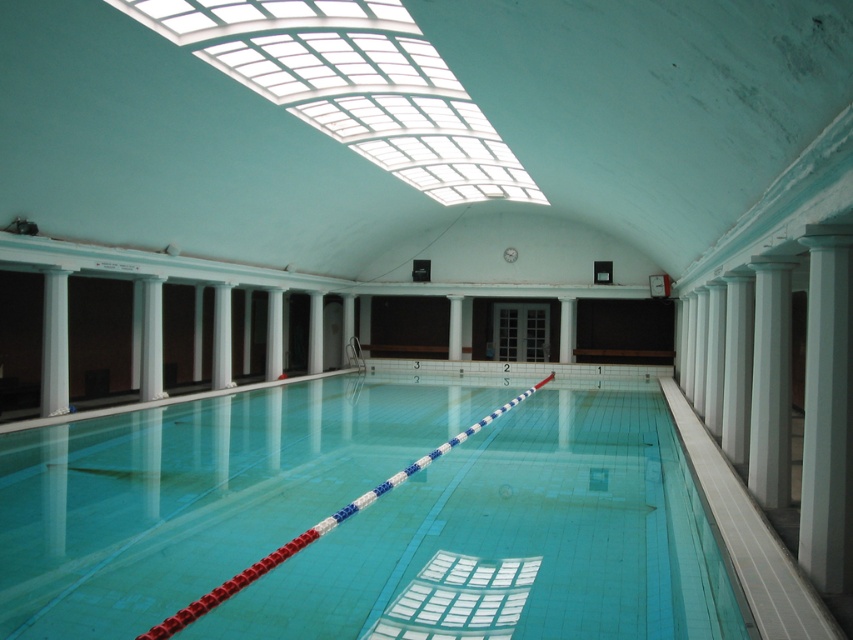
Consider the image. Is blue glossy pool at center positioned in front of white smooth column at right?

That is True.

Is blue glossy pool at center further to the viewer compared to white smooth column at right?

No, it is in front of white smooth column at right.

The image size is (853, 640). I want to click on blue glossy pool at center, so click(x=515, y=540).